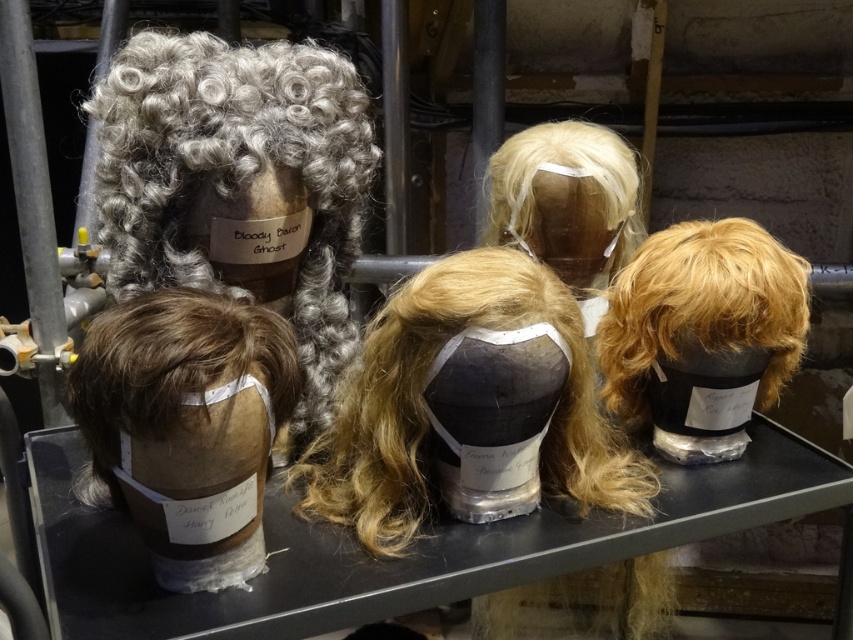
You are standing in front of the metal shelf with wigs. There are two points marked on the shelf at coordinates point (120,400) and point (608,234). Which point is closer to you?

Point (120,400) is closer to the viewer than point (608,234).

You are organizing wigs on a shelf and need to place a new wig between the brown fuzzy wig at lower left and the blonde synthetic wig at upper center. Based on their current positions, where should you place the new wig?

The brown fuzzy wig at lower left is located below the blonde synthetic wig at upper center, so the new wig should be placed between them either above the brown fuzzy wig at lower left or below the blonde synthetic wig at upper center to maintain the vertical arrangement.

You are a costume designer preparing for a play. You need to place a new wig on the shelf between the curly gray wig at upper left and the blonde synthetic wig at upper center. The new wig must be shorter than the existing ones. Where should you place it?

The new wig should be placed between the curly gray wig at upper left and the blonde synthetic wig at upper center. Since the curly gray wig at upper left is taller than the blonde synthetic wig at upper center, placing the new wig closer to the blonde synthetic wig at upper center ensures it is shorter than both existing wigs.